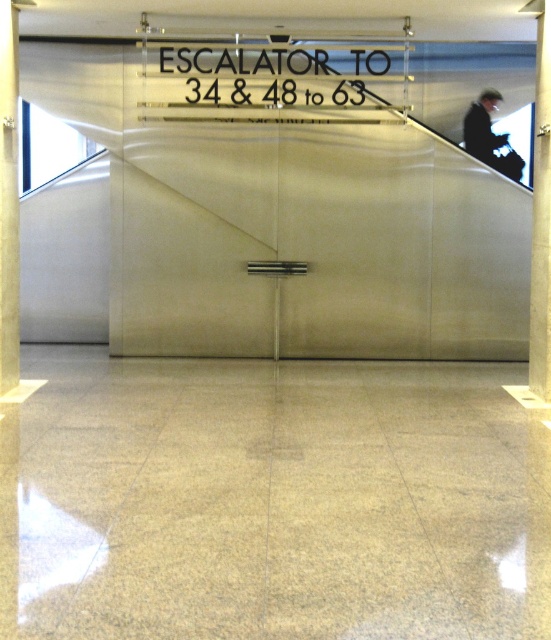
Question: Estimate the real-world distances between objects in this image. Which object is farther from the dark suit at upper right?

Choices:
 (A) metallic pillar at right
 (B) yellow polished pillar at left

Answer: (B)

Question: Is yellow polished pillar at left smaller than metallic pillar at right?

Choices:
 (A) no
 (B) yes

Answer: (B)

Question: Which is nearer to the dark suit at upper right?

Choices:
 (A) metallic pillar at right
 (B) yellow polished pillar at left

Answer: (A)

Question: Where is yellow polished pillar at left located in relation to dark suit at upper right in the image?

Choices:
 (A) above
 (B) below

Answer: (B)

Question: Which of the following is the closest to the observer?

Choices:
 (A) (8, 205)
 (B) (542, 196)

Answer: (A)

Question: Is yellow polished pillar at left bigger than metallic pillar at right?

Choices:
 (A) yes
 (B) no

Answer: (B)